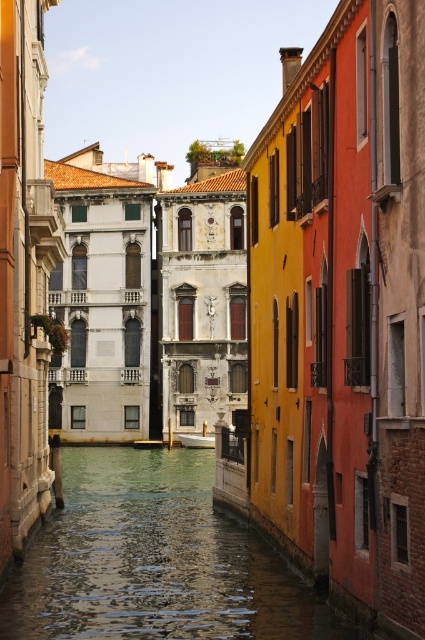
Between point (121, 506) and point (209, 435), which one is positioned in front?

Point (121, 506)

Is point (289, 596) more distant than point (183, 442)?

No, it is in front of (183, 442).

The image size is (425, 640). I want to click on greenish water at center, so pos(155,561).